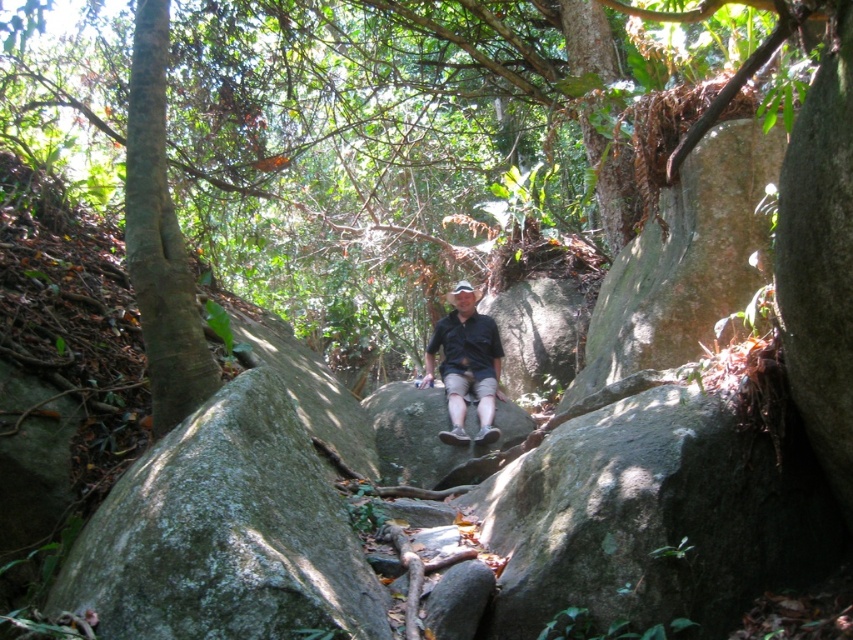
Question: Does gray rough rock at center appear over matte black shirt at center?

Choices:
 (A) yes
 (B) no

Answer: (B)

Question: Which object appears closest to the camera in this image?

Choices:
 (A) green leafy tree at center
 (B) gray rough rock at center
 (C) matte black shirt at center

Answer: (A)

Question: Does green leafy tree at center come behind matte black shirt at center?

Choices:
 (A) no
 (B) yes

Answer: (A)

Question: Which of the following is the farthest from the observer?

Choices:
 (A) (57, 112)
 (B) (390, 416)
 (C) (450, 387)

Answer: (A)

Question: Based on their relative distances, which object is farther from the green leafy tree at center?

Choices:
 (A) gray rough rock at center
 (B) matte black shirt at center

Answer: (A)

Question: Does gray rough rock at center appear on the left side of matte black shirt at center?

Choices:
 (A) yes
 (B) no

Answer: (A)